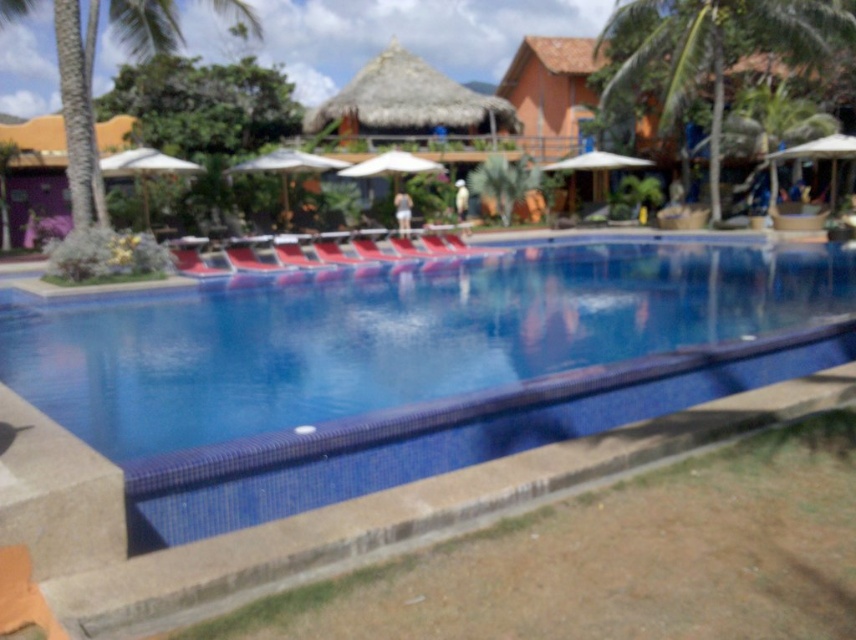
Can you confirm if green leafy palm tree at upper right is shorter than red fabric daybed at center?

In fact, green leafy palm tree at upper right may be taller than red fabric daybed at center.

Does green leafy palm tree at upper right come behind red fabric daybed at center?

Yes, green leafy palm tree at upper right is further from the viewer.

Is point (779, 32) farther from viewer compared to point (397, 241)?

Yes, it is.

Where is `green leafy palm tree at upper right`? This screenshot has width=856, height=640. green leafy palm tree at upper right is located at coordinates (715, 49).

Who is higher up, blue tile swimming pool at center or green leafy palm tree at upper right?

green leafy palm tree at upper right is higher up.

Between blue tile swimming pool at center and green leafy palm tree at upper right, which one has more height?

green leafy palm tree at upper right is taller.

The image size is (856, 640). Describe the element at coordinates (413, 369) in the screenshot. I see `blue tile swimming pool at center` at that location.

I want to click on blue tile swimming pool at center, so click(x=413, y=369).

Is blue glossy pool at center to the left of green leafy palm tree at upper right from the viewer's perspective?

Indeed, blue glossy pool at center is positioned on the left side of green leafy palm tree at upper right.

Consider the image. Which of these two, blue glossy pool at center or green leafy palm tree at upper right, stands taller?

blue glossy pool at center is taller.

Between point (480, 60) and point (702, 68), which one is positioned behind?

The point (480, 60) is more distant.

Find the location of a particular element. The width and height of the screenshot is (856, 640). blue glossy pool at center is located at coordinates (357, 28).